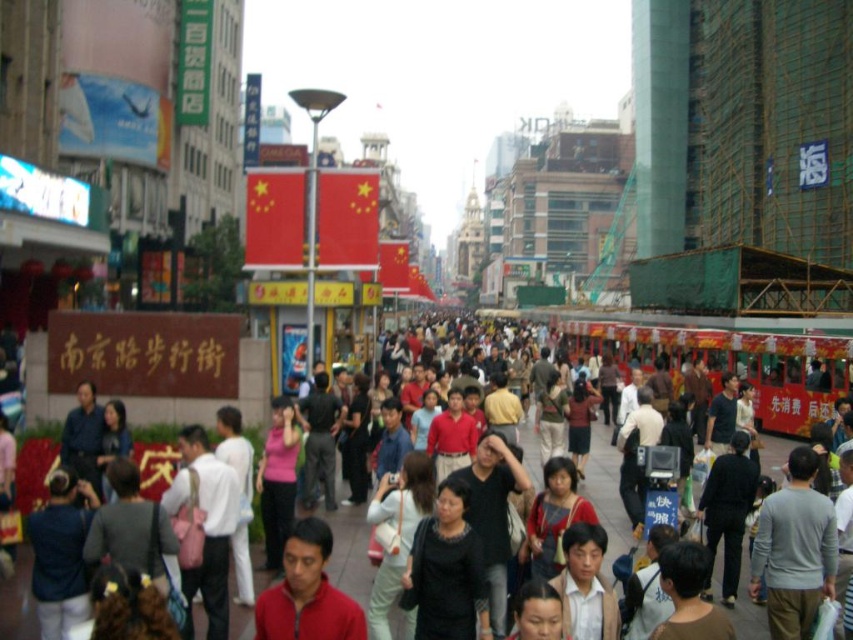
Does matte black crowd at center have a smaller size compared to matte red shirt at center?

No, matte black crowd at center is not smaller than matte red shirt at center.

Does point (15, 576) lie in front of point (325, 524)?

No, it is behind (325, 524).

Is point (67, 400) positioned after point (320, 580)?

That is True.

This screenshot has width=853, height=640. What are the coordinates of `matte black crowd at center` in the screenshot? It's located at (606, 492).